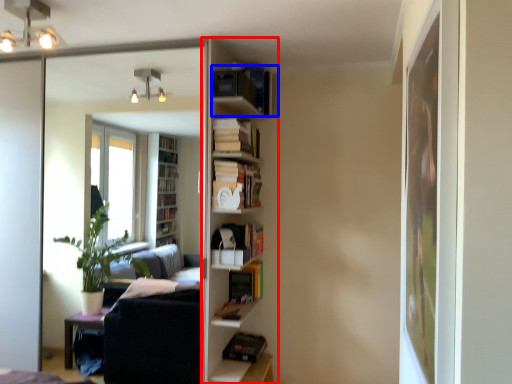
Question: Which object is further to the camera taking this photo, shelf (highlighted by a red box) or book (highlighted by a blue box)?

Choices:
 (A) shelf
 (B) book

Answer: (A)